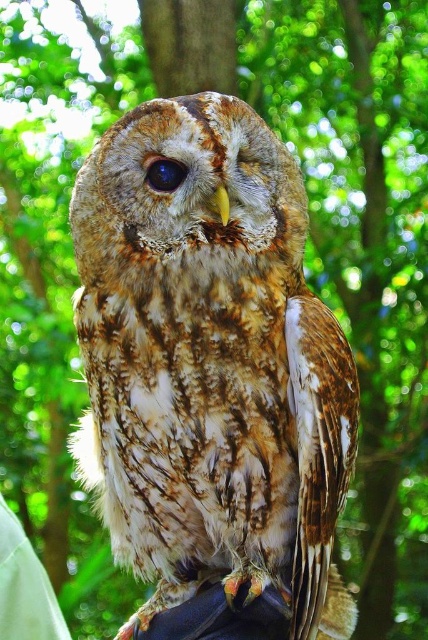
You are a photographer holding a camera. You want to take a photo of the Tawany Owl perched on the white fabric at lower left. To get a clear shot, you need to be at least 1.6 meters away from the owl. Are you close enough?

The distance between the white fabric at lower left and the viewer is 1.57 meters. Since 1.57 meters is less than 1.6 meters, you are too close to get a clear shot.

You are a photographer trying to capture the Tawny Owl in the image. You notice two points in the scene labeled as point 1 at coordinates point (154, 504) and point 2 at coordinates point (0, 525). Which point is closer to the camera lens?

Point 1 at coordinates point (154, 504) is closer to the camera lens because it is in front of point 2 at coordinates point (0, 525).

You are a photographer trying to capture the Tawny Owl in the image. You want to focus on the brown speckled feathers at center and the brown textured eye at center. Which of these two features is closer to the camera lens?

The brown speckled feathers at center are closer to the viewer than the brown textured eye at center, so the brown speckled feathers at center would be in focus first.